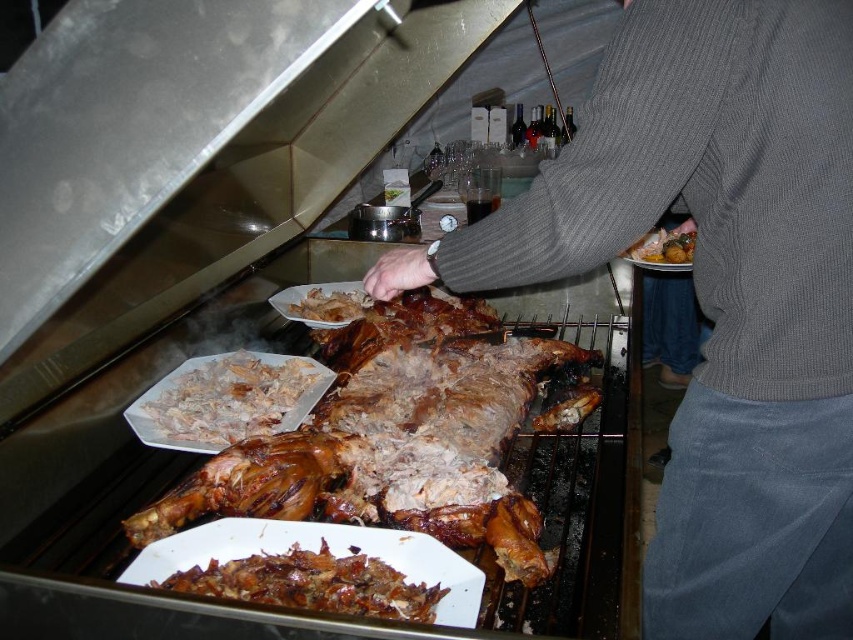
Question: Estimate the real-world distances between objects in this image. Which object is closer to the brown crispy roasted lamb at center?

Choices:
 (A) brown crispy skin at center
 (B) shiny metallic plate at center

Answer: (A)

Question: Can you confirm if translucent white shredded food at center is wider than shiny metallic plate at center?

Choices:
 (A) yes
 (B) no

Answer: (A)

Question: Considering the relative positions of brown crispy skin at center and shiny metallic plate at center in the image provided, where is brown crispy skin at center located with respect to shiny metallic plate at center?

Choices:
 (A) below
 (B) above

Answer: (A)

Question: Which point is closer to the camera?

Choices:
 (A) brown crispy roasted lamb at center
 (B) translucent white shredded food at center
 (C) white shredded meat at lower left

Answer: (A)

Question: Considering the real-world distances, which object is farthest from the brown crispy skin at center?

Choices:
 (A) gray ribbed sweater at center
 (B) shiny metallic plate at center

Answer: (B)

Question: Where is brown crispy skin at center located in relation to translucent white shredded food at center in the image?

Choices:
 (A) right
 (B) left

Answer: (A)